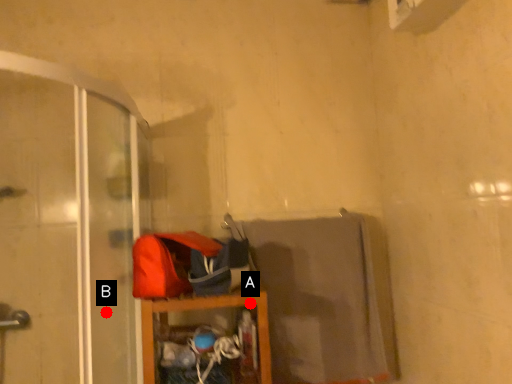
Question: Two points are circled on the image, labeled by A and B beside each circle. Which point is closer to the camera?

Choices:
 (A) A is closer
 (B) B is closer

Answer: (B)